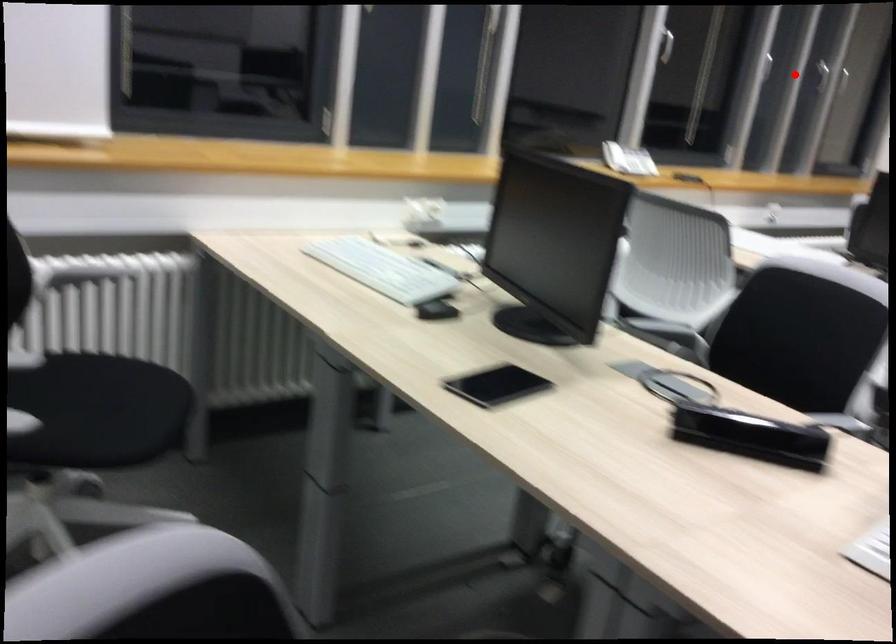
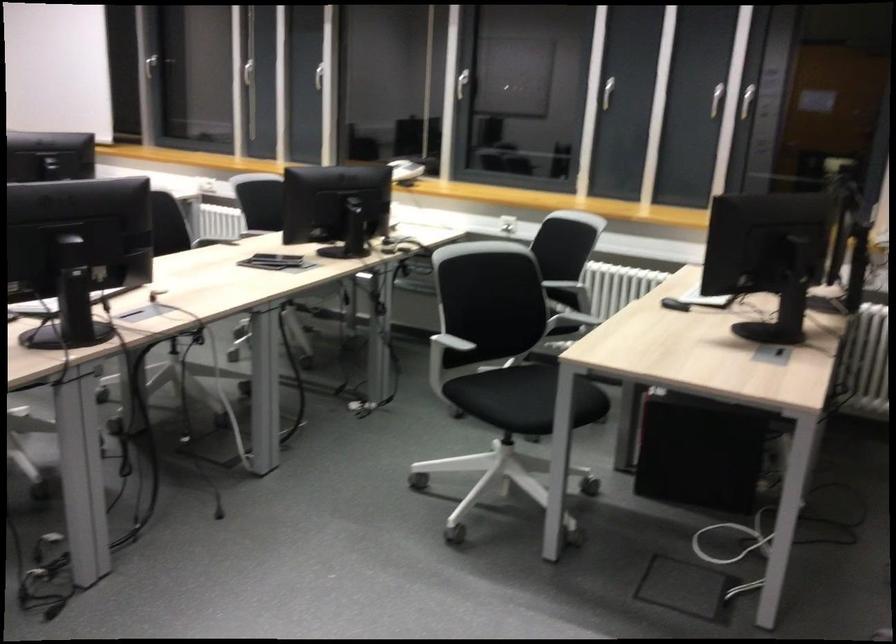
Locate, in the second image, the point that corresponds to the highlighted location in the first image.

(607, 91)